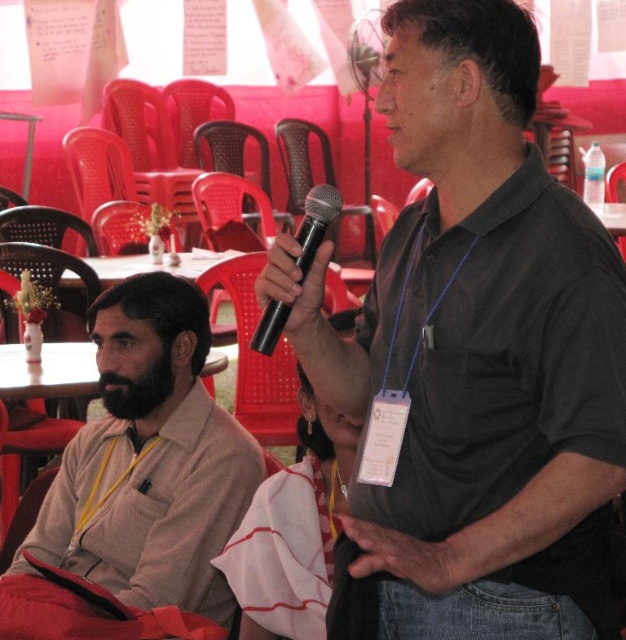
Question: Estimate the real-world distances between objects in this image. Which object is farther from the black matte microphone at center?

Choices:
 (A) black matte shirt at center
 (B) beige sweater at left

Answer: (B)

Question: Considering the relative positions of black matte shirt at center and beige sweater at left in the image provided, where is black matte shirt at center located with respect to beige sweater at left?

Choices:
 (A) left
 (B) right

Answer: (B)

Question: Which object appears closest to the camera in this image?

Choices:
 (A) beige sweater at left
 (B) black matte shirt at center
 (C) black matte microphone at center

Answer: (B)

Question: Which object appears farthest from the camera in this image?

Choices:
 (A) beige sweater at left
 (B) black matte microphone at center
 (C) black matte shirt at center

Answer: (A)

Question: In this image, where is black matte shirt at center located relative to beige sweater at left?

Choices:
 (A) left
 (B) right

Answer: (B)

Question: Observing the image, what is the correct spatial positioning of black matte shirt at center in reference to beige sweater at left?

Choices:
 (A) below
 (B) above

Answer: (B)